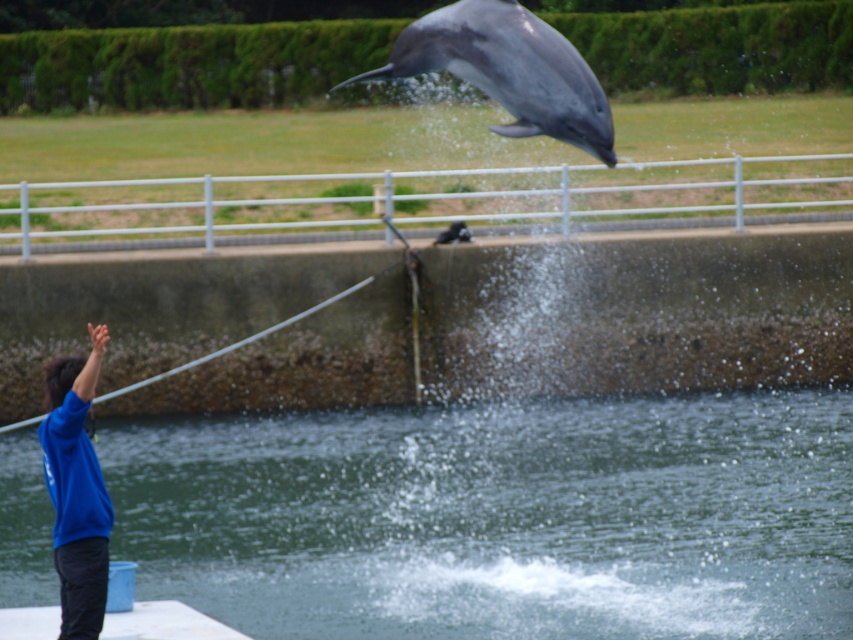
Question: Does shiny gray dolphin at upper center appear over blue fleece at left?

Choices:
 (A) yes
 (B) no

Answer: (A)

Question: Which point is closer to the camera?

Choices:
 (A) (547, 86)
 (B) (294, 552)

Answer: (A)

Question: Which object is closer to the camera taking this photo?

Choices:
 (A) blue fleece at left
 (B) clear water at lower center

Answer: (A)

Question: Which point is closer to the camera?

Choices:
 (A) blue fleece at left
 (B) shiny gray dolphin at upper center

Answer: (A)

Question: Is shiny gray dolphin at upper center wider than blue fleece at left?

Choices:
 (A) yes
 (B) no

Answer: (B)

Question: Is clear water at lower center below shiny gray dolphin at upper center?

Choices:
 (A) yes
 (B) no

Answer: (A)